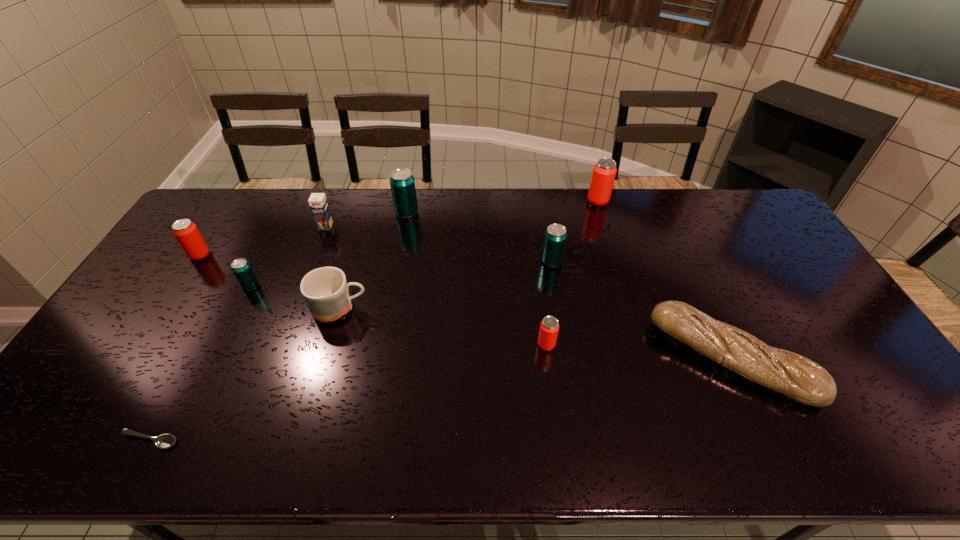
Where is `free space located on the front of the third beer can from left to right`? The height and width of the screenshot is (540, 960). free space located on the front of the third beer can from left to right is located at coordinates (402, 239).

Identify the location of blank area located on the front label of the third farthest object. (317, 250).

Find the location of a particular element. The width and height of the screenshot is (960, 540). vacant region located on the right of the rightmost teal beer can is located at coordinates (680, 261).

Find the location of a particular element. The width and height of the screenshot is (960, 540). vacant area situated 0.400m on the front of the second biggest red beer can is located at coordinates [128, 369].

The height and width of the screenshot is (540, 960). Identify the location of vacant position located 0.160m on the side with the handle of the blue mug. (424, 309).

Where is `free space located on the front of the leftmost teal beer can`? This screenshot has height=540, width=960. free space located on the front of the leftmost teal beer can is located at coordinates (206, 376).

This screenshot has width=960, height=540. I want to click on vacant space situated on the right of the nearest beer can, so click(611, 345).

This screenshot has width=960, height=540. Find the location of `free location located 0.320m on the back of the baguet`. free location located 0.320m on the back of the baguet is located at coordinates (677, 241).

Where is `free space located 0.160m on the right of the soupspoon`? free space located 0.160m on the right of the soupspoon is located at coordinates (248, 441).

Locate an element on the screen. The width and height of the screenshot is (960, 540). chocolate milk present at the far edge is located at coordinates (318, 203).